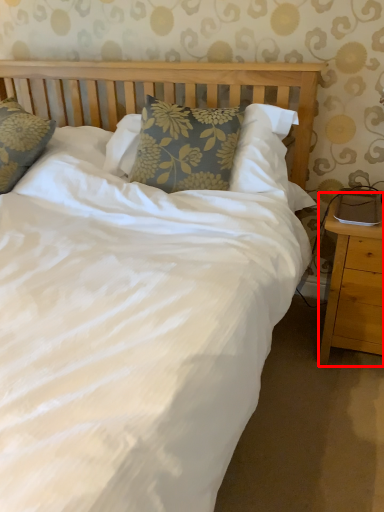
Question: From the image's perspective, what is the correct spatial positioning of nightstand (annotated by the red box) in reference to pillow?

Choices:
 (A) above
 (B) below

Answer: (B)